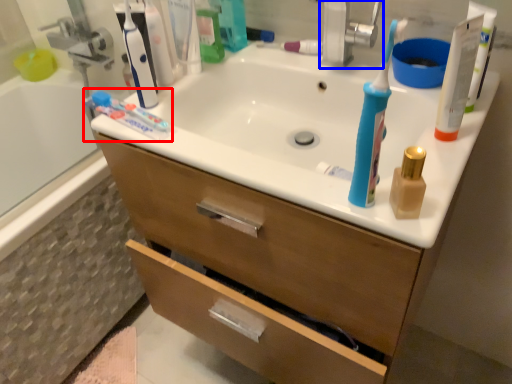
Question: Which object appears closest to the camera in this image, toothpaste (highlighted by a red box) or faucet (highlighted by a blue box)?

Choices:
 (A) toothpaste
 (B) faucet

Answer: (A)